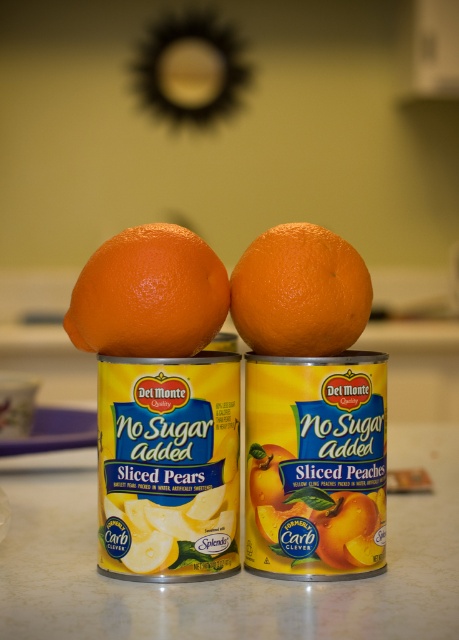
You are a grocery delivery person who needs to place an order for a customer. The customer wants to know which fruit is on the left side of the point marked at coordinates [149,294]. What is the fruit?

The point marked at coordinates [149,294] marks orangesmoothorange at left, so the fruit on the left side of the point is the orange.

You are a grocery store employee arranging fruits on a countertop. You have two oranges labeled orangesmoothorange at left and orangesmoothorange at right. Which orange should you place in the front display to be more visible to customers entering the store?

The orangesmoothorange at left should be placed in the front display because it is closer to the viewer, making it more visible to customers entering the store.